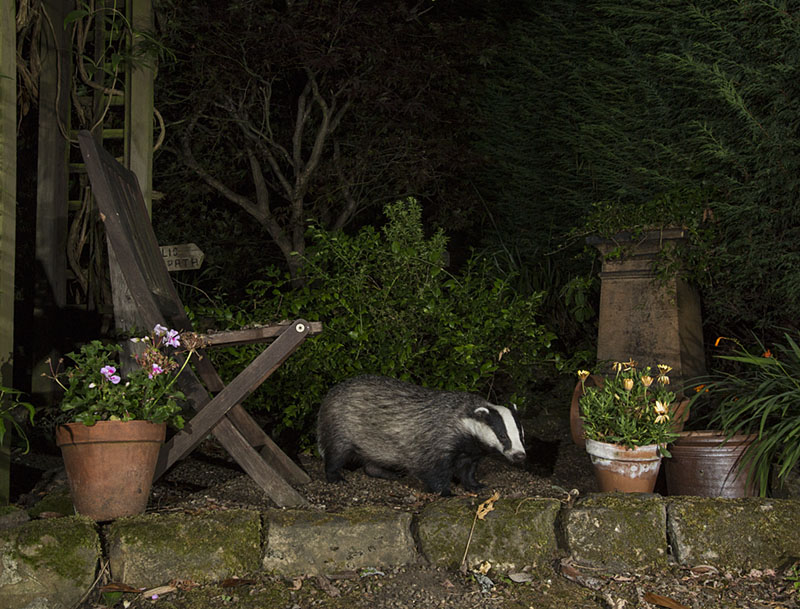
The height and width of the screenshot is (609, 800). I want to click on wooden chair, so [x=214, y=405], [x=126, y=212].